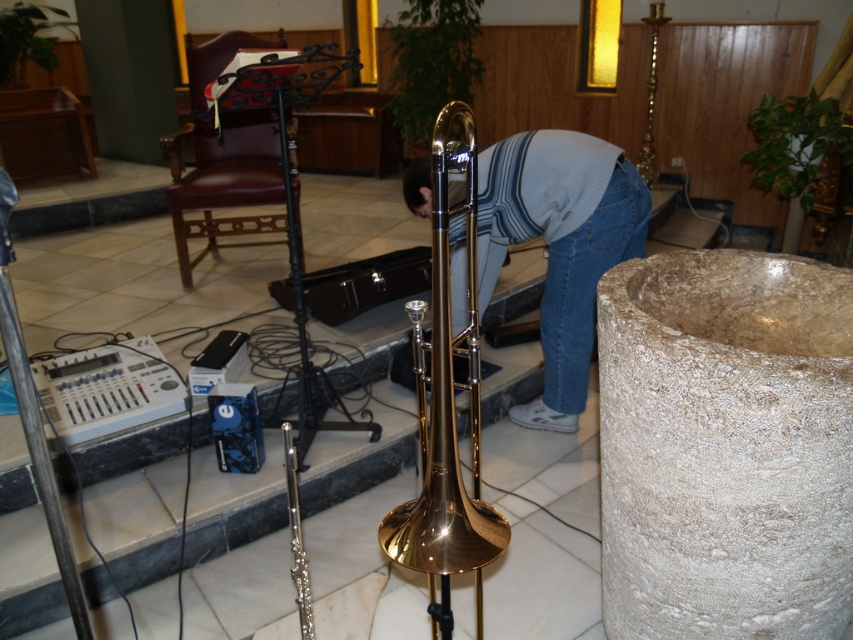
Question: Is striped sweater at center bigger than gold polished trombone at center?

Choices:
 (A) no
 (B) yes

Answer: (B)

Question: Can you confirm if striped sweater at center is bigger than gold polished trombone at center?

Choices:
 (A) no
 (B) yes

Answer: (B)

Question: Which point is closer to the camera?

Choices:
 (A) (469, 154)
 (B) (532, 131)

Answer: (A)

Question: Is striped sweater at center smaller than gold polished trombone at center?

Choices:
 (A) yes
 (B) no

Answer: (B)